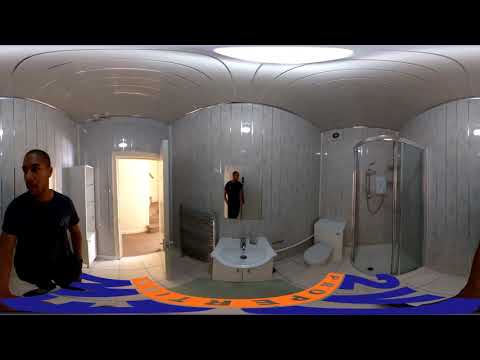
Find the location of a particular element. skylight is located at coordinates (277, 53).